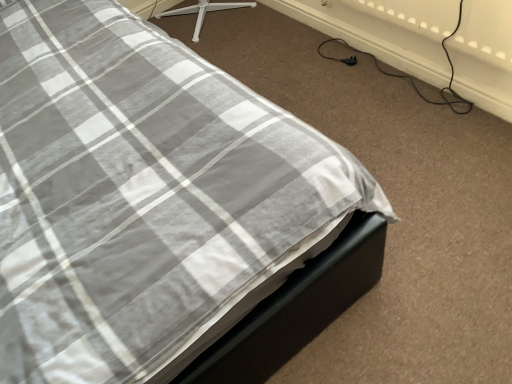
You are a GUI agent. You are given a task and a screenshot of the screen. Output one action in this format:
    pyautogui.click(x=<x>, y=<y>)
    Task: Click on the free region on the left part of black plastic plug at lower right
    The width and height of the screenshot is (512, 384).
    Given the screenshot: What is the action you would take?
    pyautogui.click(x=320, y=70)